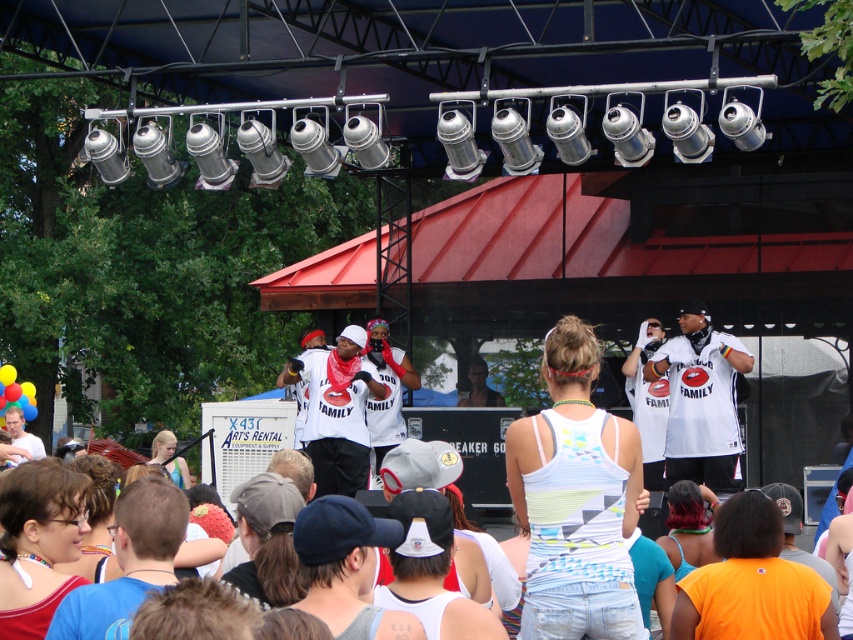
You are a photographer at the event and want to capture both the white jersey at center and the white matte shirt at center in the same frame. Since they are both white, you need to adjust your camera settings to distinguish them. Which one is positioned to the right of the other to help you frame the shot?

The white jersey at center is to the right of the white matte shirt at center.

You are at the concert and want to take a photo of both the white tank top at center and the white jersey at center. Which one should you focus on first to ensure both are in the frame?

Focus on the white tank top at center first since it is closer to you than the white jersey at center. By focusing on the closer object, both will be in focus if they are within the camera or phone camera depth of field range.

What are the coordinates of the white tank top at center?

The white tank top at center is located at point (575, 499).